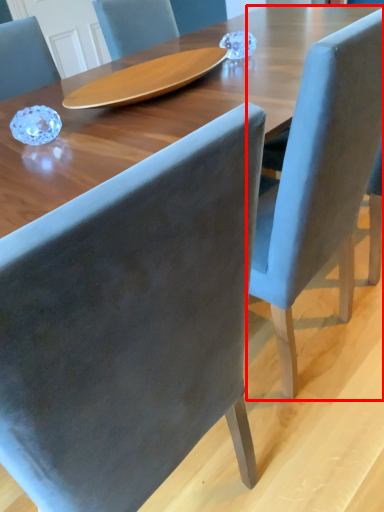
Question: From the image's perspective, where is chair (annotated by the red box) located relative to chair?

Choices:
 (A) above
 (B) below

Answer: (A)